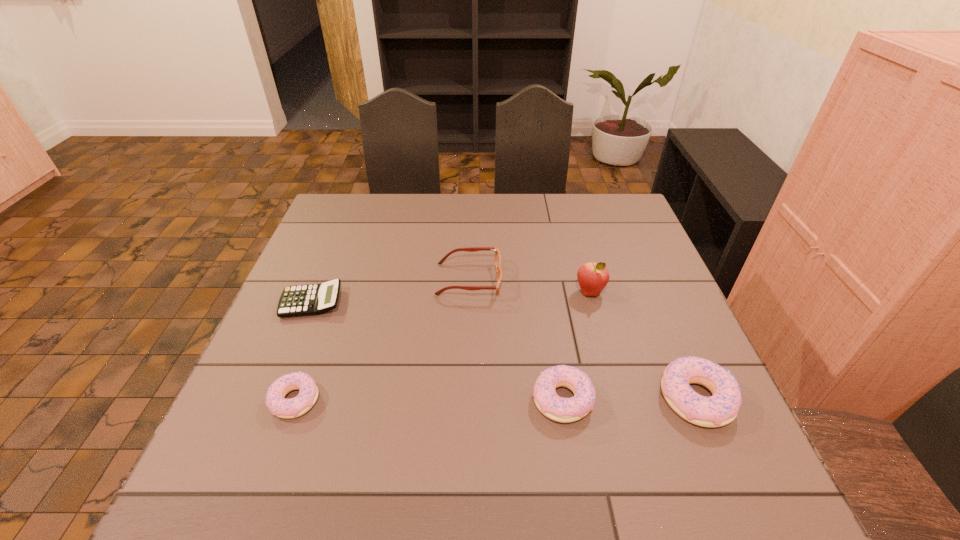
Where is `object located in the near right corner section of the desktop`? This screenshot has height=540, width=960. object located in the near right corner section of the desktop is located at coordinates (722, 408).

Identify the location of vacant region at the far edge of the desktop. This screenshot has width=960, height=540. (503, 199).

This screenshot has height=540, width=960. I want to click on free point at the near edge, so click(x=590, y=430).

The width and height of the screenshot is (960, 540). I want to click on vacant space at the left edge, so click(322, 238).

This screenshot has width=960, height=540. I want to click on vacant area at the right edge, so click(x=646, y=313).

Locate an element on the screen. free space at the far right corner is located at coordinates (596, 200).

Find the location of a particular element. The image size is (960, 540). empty space that is in between the shortest object and the second tallest doughnut is located at coordinates (437, 350).

Where is `blank region between the rightmost object and the leftmost doughnut`? blank region between the rightmost object and the leftmost doughnut is located at coordinates (495, 399).

Where is `empty space between the rightmost doughnut and the third object from left to right`? empty space between the rightmost doughnut and the third object from left to right is located at coordinates (583, 339).

The height and width of the screenshot is (540, 960). In order to click on free space between the tallest doughnut and the third object from right to left in this screenshot , I will do point(630,399).